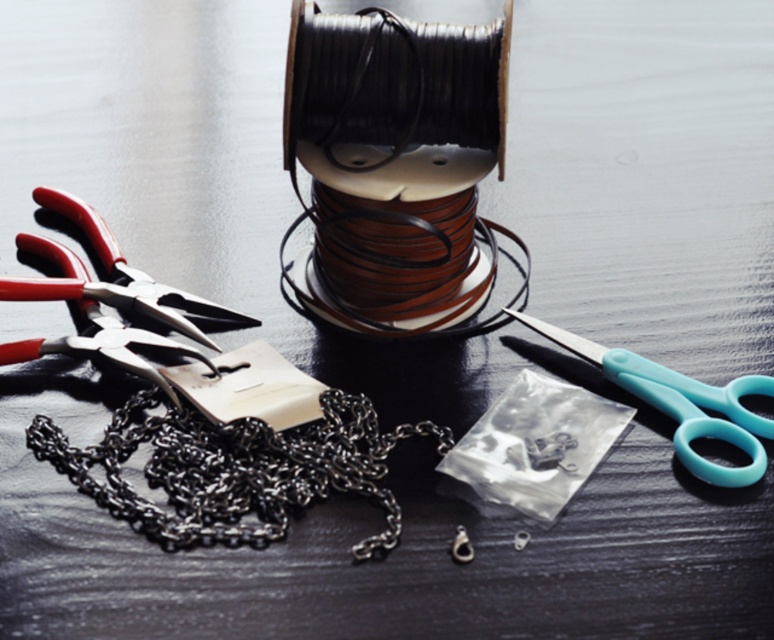
Consider the image. You are organizing the crafting tools on the dark wooden surface. You need to place a new tool between the two points marked as point (170, 408) and point (101, 232). Based on their positions, which point should the new tool be closer to?

The new tool should be placed closer to point (101, 232) because point (170, 408) is in front of it, meaning the new tool needs to be positioned behind point (170, 408) to maintain the spatial order.

You are organizing a craft workshop and need to arrange tools on a shelf. The shelf has limited vertical space. Given the image, which object between the black metallic chain at center and the matte metal pliers at left takes up less vertical space and is better suited for the shelf?

The black metallic chain at center has a lesser height compared to the matte metal pliers at left, so it takes up less vertical space and is better suited for the shelf.

You are organizing a tool kit and need to place the black metallic chain at center and the matte metal pliers at left into a drawer with a width of 10 cm. The chain is 8 cm wide and the pliers are 6 cm wide. Can both items fit side by side without overlapping?

The black metallic chain at center is 8 cm wide and the matte metal pliers at left are 6 cm wide. Combined, they measure 14 cm, which exceeds the drawer width of 10 cm. Therefore, they cannot fit side by side without overlapping.